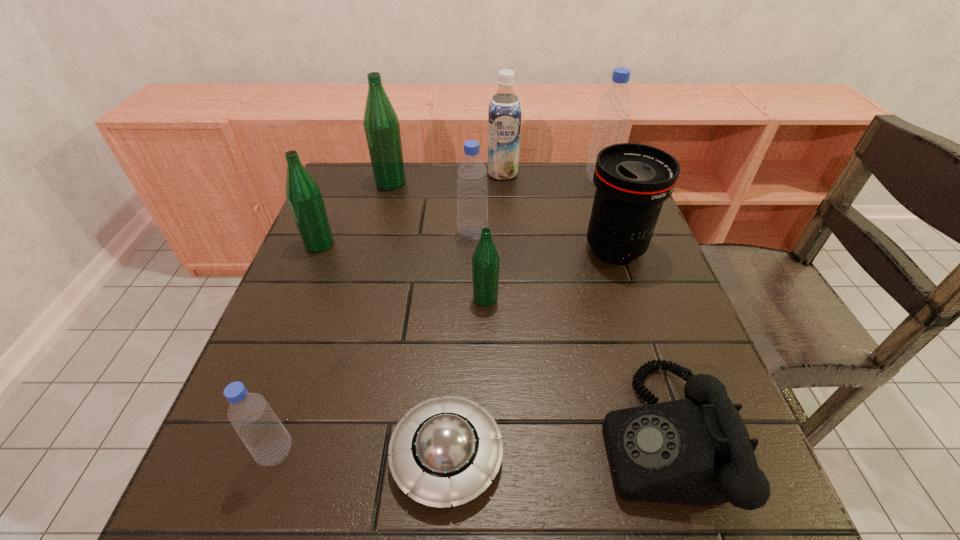
Find the location of `the rightmost blue bottle`. the rightmost blue bottle is located at coordinates (614, 108).

Where is `the rightmost bottle`? The image size is (960, 540). the rightmost bottle is located at coordinates (614, 108).

What are the coordinates of `the second green bottle from left to right` in the screenshot? It's located at (381, 124).

Locate an element on the screen. the farthest green bottle is located at coordinates point(381,124).

Find the location of `soya milk`. soya milk is located at coordinates (504, 112).

You are a GUI agent. You are given a task and a screenshot of the screen. Output one action in this format:
    pyautogui.click(x=<x>, y=<y>)
    Task: Click on the leftmost bottle
    
    Given the screenshot: What is the action you would take?
    pyautogui.click(x=303, y=194)

This screenshot has height=540, width=960. Find the location of `the leftmost object`. the leftmost object is located at coordinates (303, 194).

Image resolution: width=960 pixels, height=540 pixels. What are the coordinates of `the second biggest blue bottle` in the screenshot? It's located at (472, 193).

Where is `the second nearest blue bottle`? the second nearest blue bottle is located at coordinates (472, 193).

Locate an element on the screen. telephoto lens is located at coordinates (632, 181).